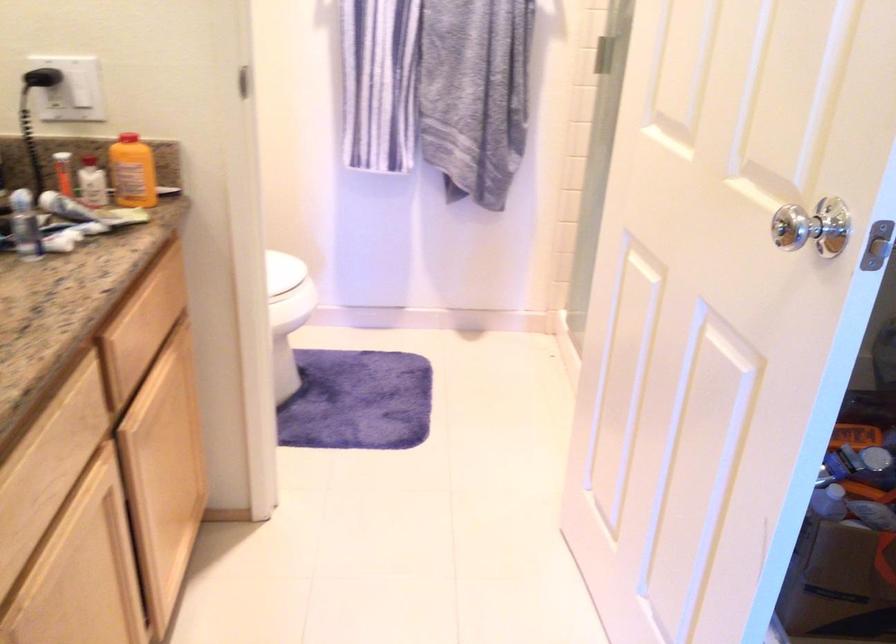
Where is `silver door knob`? The height and width of the screenshot is (644, 896). silver door knob is located at coordinates (791, 228).